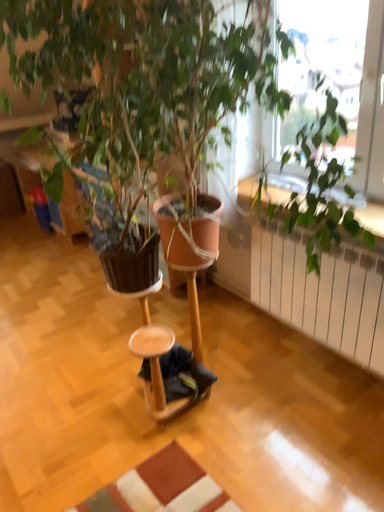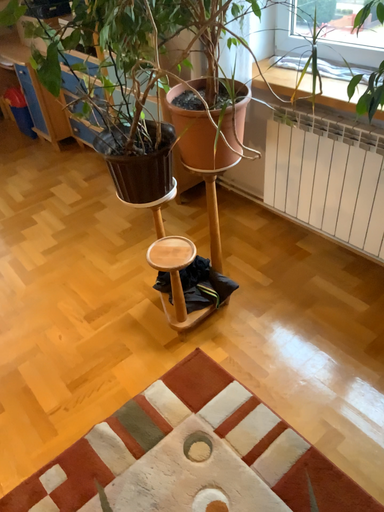
Question: How did the camera likely rotate when shooting the video?

Choices:
 (A) rotated downward
 (B) rotated upward

Answer: (A)